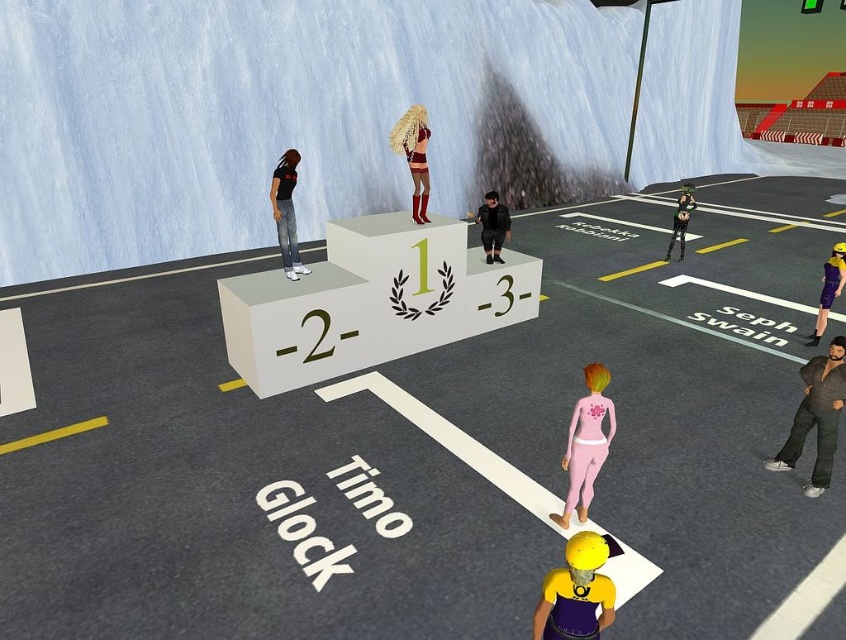
Question: Does yellow matte helmet at center have a lesser width compared to dark brown leather jacket at lower right?

Choices:
 (A) yes
 (B) no

Answer: (B)

Question: Which object appears closest to the camera in this image?

Choices:
 (A) shiny metallic dress at center
 (B) black matte pants at center

Answer: (A)

Question: Which object is farther from the camera taking this photo?

Choices:
 (A) shiny metallic dress at center
 (B) green metallic helmet at upper center

Answer: (B)

Question: Which object is closer to the camera taking this photo?

Choices:
 (A) black matte shirt at center
 (B) black matte pants at center

Answer: (A)

Question: Is dark brown leather jacket at lower right to the left of pink matte/skinny at center from the viewer's perspective?

Choices:
 (A) yes
 (B) no

Answer: (B)

Question: Can you confirm if pink matte/skinny at center is positioned to the right of green metallic helmet at upper center?

Choices:
 (A) no
 (B) yes

Answer: (A)